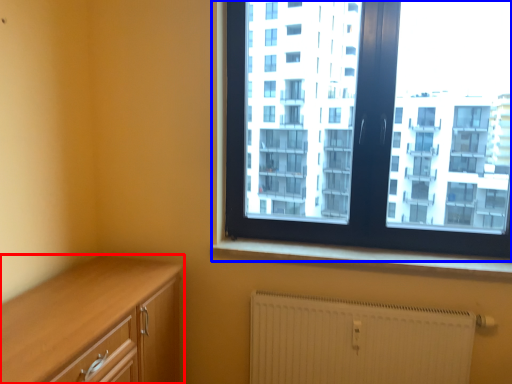
Question: Which object appears closest to the camera in this image, cabinetry (highlighted by a red box) or window (highlighted by a blue box)?

Choices:
 (A) cabinetry
 (B) window

Answer: (A)